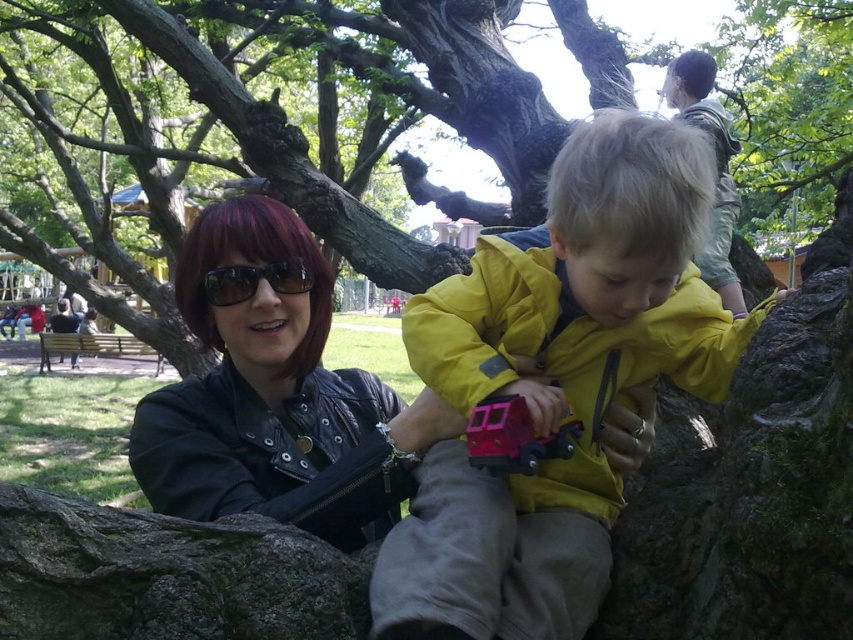
From the picture: You are a painter standing in the park and want to sketch the scene. You notice the rough bark tree at center and the light brown fabric jacket at upper right. Which object should you focus on first if you want to draw the wider one?

The rough bark tree at center is wider than the light brown fabric jacket at upper right, so you should focus on the rough bark tree at center first.

You are a park ranger who needs to place a 6.5 meter long safety net between the yellow matte jacket at center and the rough bark tree at center. Based on the provided information, will the safety net be sufficient to cover the space between them?

The distance between the yellow matte jacket at center and the rough bark tree at center is 6.65 meters. Since the safety net is 6.5 meters long, it is slightly shorter than the required distance. Therefore, the safety net will not be sufficient to cover the space between them.